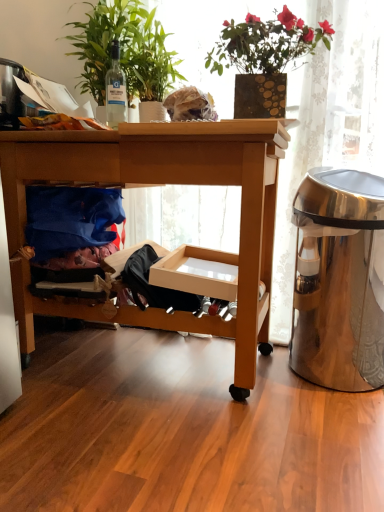
You are a GUI agent. You are given a task and a screenshot of the screen. Output one action in this format:
    pyautogui.click(x=<x>, y=<y>)
    Task: Click on the wooden desk at center
    
    Given the screenshot: What is the action you would take?
    pyautogui.click(x=155, y=184)

Between clear glass bottle at upper left and wooden vase with flowers at upper center, acting as the 2th houseplant starting from the left, which one has larger size?

wooden vase with flowers at upper center, acting as the 2th houseplant starting from the left, is bigger.

From the image's perspective, is clear glass bottle at upper left located above or below wooden vase with flowers at upper center, the 1th houseplant in the right-to-left sequence?

Clearly, from the image's perspective, clear glass bottle at upper left is below wooden vase with flowers at upper center, the 1th houseplant in the right-to-left sequence.

Could you measure the distance between clear glass bottle at upper left and wooden vase with flowers at upper center, acting as the 2th houseplant starting from the left?

A distance of 19.81 inches exists between clear glass bottle at upper left and wooden vase with flowers at upper center, acting as the 2th houseplant starting from the left.

Is clear glass bottle at upper left closer to the viewer compared to wooden vase with flowers at upper center, the 1th houseplant in the right-to-left sequence?

No, clear glass bottle at upper left is behind wooden vase with flowers at upper center, the 1th houseplant in the right-to-left sequence.

Considering the points (317, 38) and (119, 111), which point is in front, point (317, 38) or point (119, 111)?

The point (317, 38) is in front.

Consider the image. Is wooden vase with flowers at upper center, acting as the 2th houseplant starting from the left, in front of or behind clear glass bottle at upper left in the image?

Visually, wooden vase with flowers at upper center, acting as the 2th houseplant starting from the left, is located in front of clear glass bottle at upper left.

From the image's perspective, is wooden vase with flowers at upper center, acting as the 2th houseplant starting from the left, on top of clear glass bottle at upper left?

Yes, from the image's perspective, wooden vase with flowers at upper center, acting as the 2th houseplant starting from the left, is above clear glass bottle at upper left.

Is blue fabric at lower left placed right next to wooden vase with flowers at upper center, acting as the 2th houseplant starting from the left?

blue fabric at lower left and wooden vase with flowers at upper center, acting as the 2th houseplant starting from the left, are clearly separated.

Is blue fabric at lower left positioned with its back to wooden vase with flowers at upper center, the 1th houseplant in the right-to-left sequence?

blue fabric at lower left is not turned away from wooden vase with flowers at upper center, the 1th houseplant in the right-to-left sequence.

From their relative heights in the image, would you say blue fabric at lower left is taller or shorter than wooden vase with flowers at upper center, acting as the 2th houseplant starting from the left?

Considering their sizes, blue fabric at lower left has less height than wooden vase with flowers at upper center, acting as the 2th houseplant starting from the left.

From a real-world perspective, is wooden vase with flowers at upper center, acting as the 2th houseplant starting from the left, physically above blue fabric at lower left?

Yes, from a real-world perspective, wooden vase with flowers at upper center, acting as the 2th houseplant starting from the left, is on top of blue fabric at lower left.

Can you confirm if wooden vase with flowers at upper center, the 1th houseplant in the right-to-left sequence, is wider than blue fabric at lower left?

Yes, wooden vase with flowers at upper center, the 1th houseplant in the right-to-left sequence, is wider than blue fabric at lower left.

Which object is closer to the camera taking this photo, wooden vase with flowers at upper center, acting as the 2th houseplant starting from the left, or blue fabric at lower left?

wooden vase with flowers at upper center, acting as the 2th houseplant starting from the left, is more forward.

Who is taller, wooden vase with flowers at upper center, acting as the 2th houseplant starting from the left, or blue fabric at lower left?

Standing taller between the two is wooden vase with flowers at upper center, acting as the 2th houseplant starting from the left.

Based on the photo, is satin silver trash can at right at the back of green glossy plant at upper left, the first houseplant from the left?

No, green glossy plant at upper left, the first houseplant from the left, is not facing the opposite direction of satin silver trash can at right.

Considering the relative sizes of green glossy plant at upper left, the first houseplant from the left, and satin silver trash can at right in the image provided, is green glossy plant at upper left, the first houseplant from the left, shorter than satin silver trash can at right?

Indeed, green glossy plant at upper left, the first houseplant from the left, has a lesser height compared to satin silver trash can at right.

Is point (103, 79) farther from viewer compared to point (313, 184)?

Yes.

Can satin silver trash can at right be found inside green glossy plant at upper left, which ranks as the 2th houseplant in right-to-left order?

No, satin silver trash can at right is not a part of green glossy plant at upper left, which ranks as the 2th houseplant in right-to-left order.

Is blue fabric at lower left directly adjacent to green glossy plant at upper left, the first houseplant from the left?

No, blue fabric at lower left is not making contact with green glossy plant at upper left, the first houseplant from the left.

Is blue fabric at lower left wider than green glossy plant at upper left, the first houseplant from the left?

No, blue fabric at lower left is not wider than green glossy plant at upper left, the first houseplant from the left.

Locate an element on the screen. This screenshot has width=384, height=512. houseplant that is the 2nd one when counting upward from the blue fabric at lower left (from the image's perspective) is located at coordinates (124, 50).

Considering the positions of points (254, 115) and (261, 337), is point (254, 115) farther from camera compared to point (261, 337)?

That is False.

Considering the relative positions of wooden vase with flowers at upper center, acting as the 2th houseplant starting from the left, and wooden desk at center in the image provided, is wooden vase with flowers at upper center, acting as the 2th houseplant starting from the left, to the left of wooden desk at center from the viewer's perspective?

In fact, wooden vase with flowers at upper center, acting as the 2th houseplant starting from the left, is to the right of wooden desk at center.

Measure the distance from wooden vase with flowers at upper center, the 1th houseplant in the right-to-left sequence, to wooden desk at center.

wooden vase with flowers at upper center, the 1th houseplant in the right-to-left sequence, and wooden desk at center are 16.17 inches apart.

Is wooden vase with flowers at upper center, acting as the 2th houseplant starting from the left, taller or shorter than wooden desk at center?

Considering their sizes, wooden vase with flowers at upper center, acting as the 2th houseplant starting from the left, has less height than wooden desk at center.

From the clear glass bottle at upper left, count 2nd houseplants forward and point to it. Please provide its 2D coordinates.

[(264, 58)]

The width and height of the screenshot is (384, 512). In order to click on houseplant that is the 1st one above the clear glass bottle at upper left (from a real-world perspective) in this screenshot , I will do (x=264, y=58).

When comparing their distances from wooden vase with flowers at upper center, acting as the 2th houseplant starting from the left, does satin silver trash can at right or wooden desk at center seem closer?

wooden desk at center.

From the picture: Which object lies nearer to the anchor point wooden vase with flowers at upper center, acting as the 2th houseplant starting from the left, blue fabric at lower left or wooden desk at center?

The object closer to wooden vase with flowers at upper center, acting as the 2th houseplant starting from the left, is wooden desk at center.

Based on their spatial positions, is wooden vase with flowers at upper center, the 1th houseplant in the right-to-left sequence, or clear glass bottle at upper left further from wooden desk at center?

clear glass bottle at upper left is further to wooden desk at center.

From the image, which object appears to be farther from wooden vase with flowers at upper center, acting as the 2th houseplant starting from the left, wooden desk at center or green glossy plant at upper left, the first houseplant from the left?

Based on the image, wooden desk at center appears to be further to wooden vase with flowers at upper center, acting as the 2th houseplant starting from the left.

Looking at the image, which one is located further to green glossy plant at upper left, which ranks as the 2th houseplant in right-to-left order, wooden vase with flowers at upper center, the 1th houseplant in the right-to-left sequence, or blue fabric at lower left?

blue fabric at lower left is further to green glossy plant at upper left, which ranks as the 2th houseplant in right-to-left order.

Considering their positions, is clear glass bottle at upper left positioned closer to wooden vase with flowers at upper center, the 1th houseplant in the right-to-left sequence, than satin silver trash can at right?

clear glass bottle at upper left is positioned closer to the anchor wooden vase with flowers at upper center, the 1th houseplant in the right-to-left sequence.

Which object lies further to the anchor point wooden vase with flowers at upper center, acting as the 2th houseplant starting from the left, wooden desk at center or satin silver trash can at right?

Among the two, satin silver trash can at right is located further to wooden vase with flowers at upper center, acting as the 2th houseplant starting from the left.

Considering their positions, is wooden desk at center positioned closer to green glossy plant at upper left, the first houseplant from the left, than satin silver trash can at right?

wooden desk at center is positioned closer to the anchor green glossy plant at upper left, the first houseplant from the left.

The image size is (384, 512). I want to click on desk between green glossy plant at upper left, which ranks as the 2th houseplant in right-to-left order, and satin silver trash can at right, so click(x=155, y=184).

In order to click on desk situated between blue fabric at lower left and satin silver trash can at right from left to right in this screenshot , I will do `click(155, 184)`.

Locate an element on the screen. This screenshot has width=384, height=512. desk between wooden vase with flowers at upper center, the 1th houseplant in the right-to-left sequence, and satin silver trash can at right in the up-down direction is located at coordinates (155, 184).

Identify the location of desk situated between blue fabric at lower left and wooden vase with flowers at upper center, acting as the 2th houseplant starting from the left, from left to right. (155, 184).